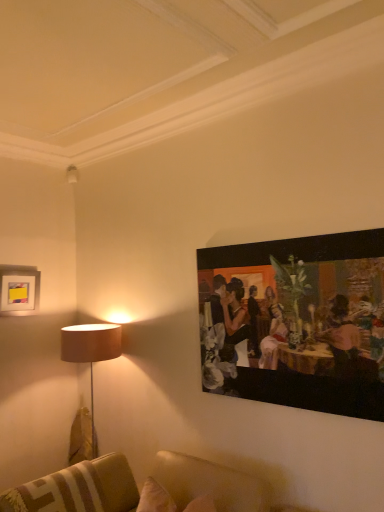
Question: Can you confirm if matte white picture frame at upper left, the 2th picture frame in the right-to-left sequence, is positioned to the right of oil painting at upper right, the first picture frame when ordered from right to left?

Choices:
 (A) yes
 (B) no

Answer: (B)

Question: Does matte white picture frame at upper left, marked as the 1th picture frame in a back-to-front arrangement, contain oil painting at upper right, the first picture frame when ordered from right to left?

Choices:
 (A) no
 (B) yes

Answer: (A)

Question: Does matte white picture frame at upper left, which is the first picture frame in left-to-right order, have a larger size compared to oil painting at upper right, the first picture frame when ordered from right to left?

Choices:
 (A) no
 (B) yes

Answer: (A)

Question: Can you confirm if matte white picture frame at upper left, marked as the 1th picture frame in a back-to-front arrangement, is positioned to the left of oil painting at upper right, which is the 2th picture frame in back-to-front order?

Choices:
 (A) no
 (B) yes

Answer: (B)

Question: Are matte white picture frame at upper left, the 2th picture frame in the right-to-left sequence, and oil painting at upper right, the first picture frame when ordered from right to left, beside each other?

Choices:
 (A) no
 (B) yes

Answer: (A)

Question: Is matte white picture frame at upper left, the 2th picture frame in the right-to-left sequence, spatially inside leather couch at lower center, or outside of it?

Choices:
 (A) outside
 (B) inside

Answer: (A)

Question: Considering the positions of point (34, 303) and point (266, 490), is point (34, 303) closer or farther from the camera than point (266, 490)?

Choices:
 (A) farther
 (B) closer

Answer: (A)

Question: Considering their positions, is matte white picture frame at upper left, which is the first picture frame in left-to-right order, located in front of or behind leather couch at lower center?

Choices:
 (A) behind
 (B) front

Answer: (A)

Question: Looking at the image, does matte white picture frame at upper left, which ranks as the 2th picture frame in front-to-back order, seem bigger or smaller compared to leather couch at lower center?

Choices:
 (A) big
 (B) small

Answer: (B)

Question: Would you say leather couch at lower center is inside or outside matte white picture frame at upper left, the 2th picture frame in the right-to-left sequence?

Choices:
 (A) outside
 (B) inside

Answer: (A)

Question: Is point (82, 490) closer or farther from the camera than point (34, 291)?

Choices:
 (A) closer
 (B) farther

Answer: (A)

Question: Considering the positions of leather couch at lower center and matte white picture frame at upper left, which ranks as the 2th picture frame in front-to-back order, in the image, is leather couch at lower center bigger or smaller than matte white picture frame at upper left, which ranks as the 2th picture frame in front-to-back order,?

Choices:
 (A) big
 (B) small

Answer: (A)

Question: In terms of height, does leather couch at lower center look taller or shorter compared to matte white picture frame at upper left, which is the first picture frame in left-to-right order?

Choices:
 (A) tall
 (B) short

Answer: (B)

Question: Based on their sizes in the image, would you say matte white picture frame at upper left, which ranks as the 2th picture frame in front-to-back order, is bigger or smaller than oil painting at upper right, which is the 2th picture frame in back-to-front order?

Choices:
 (A) small
 (B) big

Answer: (A)

Question: Is point (9, 284) closer or farther from the camera than point (309, 281)?

Choices:
 (A) closer
 (B) farther

Answer: (B)